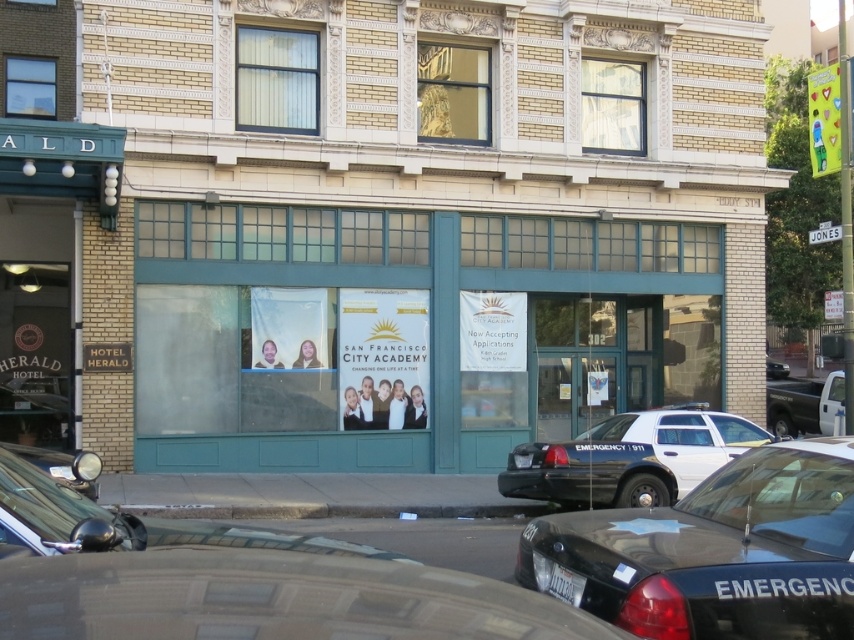
You are a pedestrian standing on the sidewalk across from the building. You need to cross the street to enter the San Francisco City Academy. Which vehicle, the black glossy emergency vehicle at lower center or the metallic silver truck at right, is closer to you?

The black glossy emergency vehicle at lower center is closer to you because it is in front of the metallic silver truck at right.